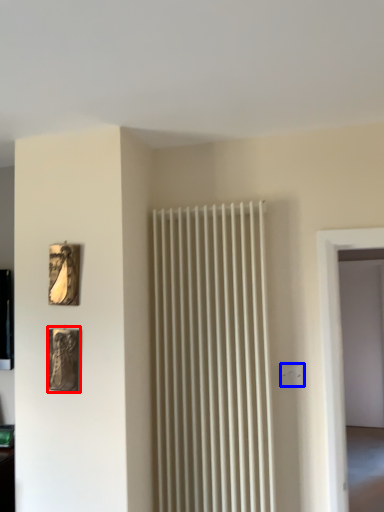
Question: Which object is further to the camera taking this photo, picture frame (highlighted by a red box) or electric outlet (highlighted by a blue box)?

Choices:
 (A) picture frame
 (B) electric outlet

Answer: (B)